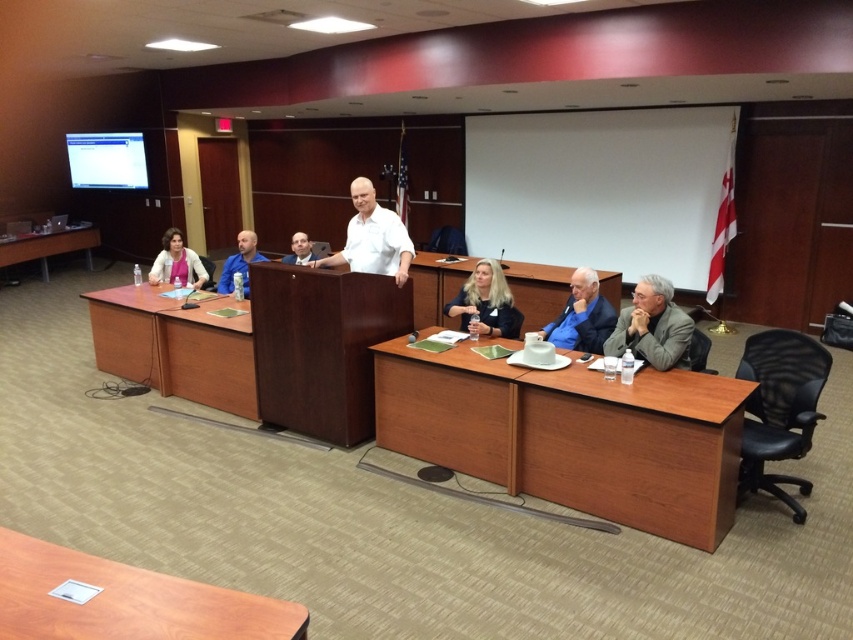
Question: Is wooden table at lower left below matte black shirt at center?

Choices:
 (A) no
 (B) yes

Answer: (B)

Question: Which is nearer to the white matte shirt at center?

Choices:
 (A) gray fabric suit at lower right
 (B) cherry wood table at lower center
 (C) matte pink blouse at left
 (D) wooden table at lower left

Answer: (B)

Question: Which point appears farthest from the camera in this image?

Choices:
 (A) (607, 323)
 (B) (370, 186)

Answer: (B)

Question: Observing the image, what is the correct spatial positioning of blue shirt at center in reference to matte black shirt at center?

Choices:
 (A) right
 (B) left

Answer: (B)

Question: Can you confirm if blonde hair woman at center is positioned to the left of matte pink blouse at left?

Choices:
 (A) no
 (B) yes

Answer: (A)

Question: Which of the following is the closest to the observer?

Choices:
 (A) brown wood table at lower left
 (B) wooden table at center
 (C) matte pink blouse at left
 (D) blue shirt at center

Answer: (D)